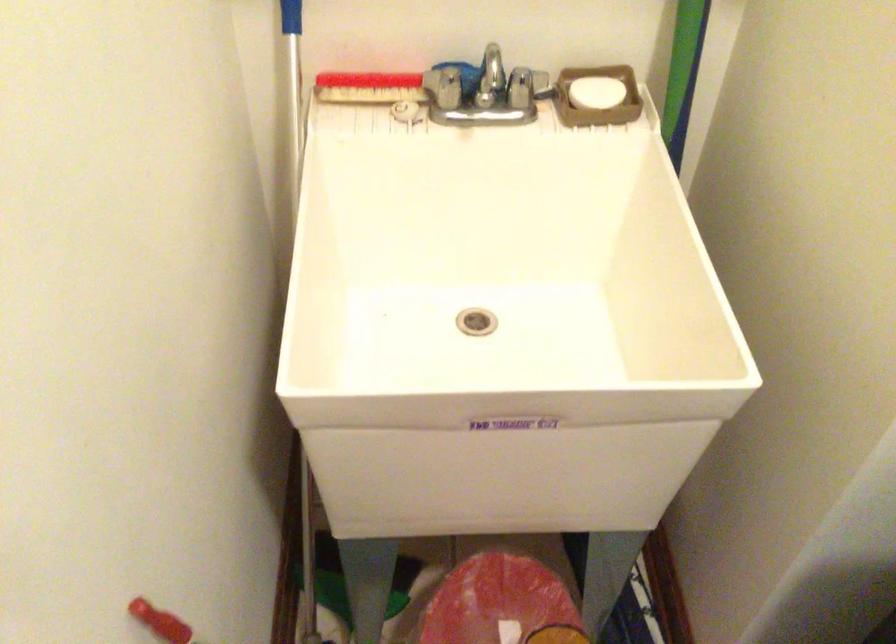
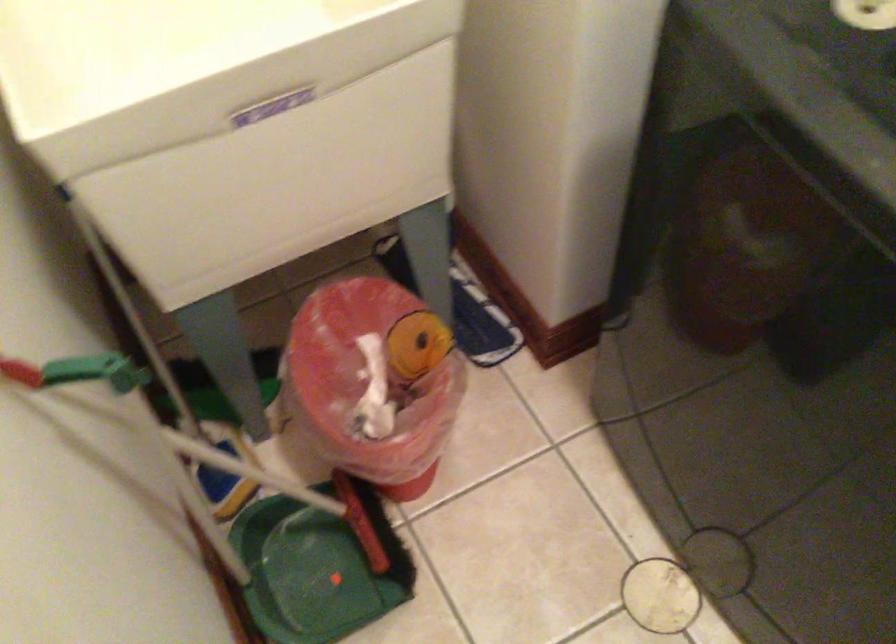
Question: The images are taken continuously from a first-person perspective. In which direction is your viewpoint rotating?

Choices:
 (A) Left
 (B) Right
 (C) Up
 (D) Down

Answer: (D)